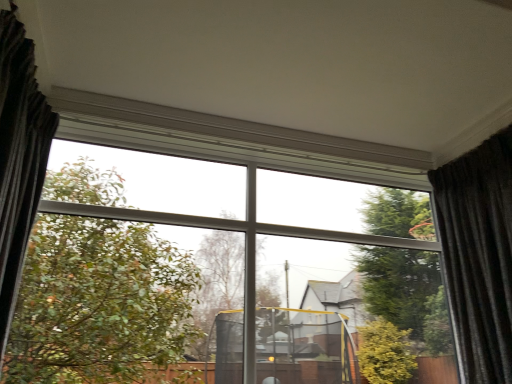
Question: From a real-world perspective, relative to dark gray textured curtain at left, arranged as the 2th curtain when viewed from the right, is dark grey textured curtain at right, the 2th curtain viewed from the left, vertically above or below?

Choices:
 (A) below
 (B) above

Answer: (A)

Question: Relative to dark gray textured curtain at left, the first curtain viewed from the left, is dark grey textured curtain at right, placed as the 1th curtain when sorted from right to left, in front or behind?

Choices:
 (A) front
 (B) behind

Answer: (B)

Question: Considering the positions of point (495, 235) and point (15, 31), is point (495, 235) closer or farther from the camera than point (15, 31)?

Choices:
 (A) farther
 (B) closer

Answer: (A)

Question: Is dark gray textured curtain at left, arranged as the 2th curtain when viewed from the right, wider or thinner than dark grey textured curtain at right, placed as the 1th curtain when sorted from right to left?

Choices:
 (A) thin
 (B) wide

Answer: (A)

Question: Considering the positions of dark gray textured curtain at left, arranged as the 2th curtain when viewed from the right, and dark grey textured curtain at right, the 2th curtain viewed from the left, in the image, is dark gray textured curtain at left, arranged as the 2th curtain when viewed from the right, bigger or smaller than dark grey textured curtain at right, the 2th curtain viewed from the left,?

Choices:
 (A) small
 (B) big

Answer: (A)

Question: From the image's perspective, is dark gray textured curtain at left, the first curtain viewed from the left, located above or below dark grey textured curtain at right, placed as the 1th curtain when sorted from right to left?

Choices:
 (A) below
 (B) above

Answer: (B)

Question: Considering their positions, is dark gray textured curtain at left, the first curtain viewed from the left, located in front of or behind dark grey textured curtain at right, the 2th curtain viewed from the left?

Choices:
 (A) front
 (B) behind

Answer: (A)